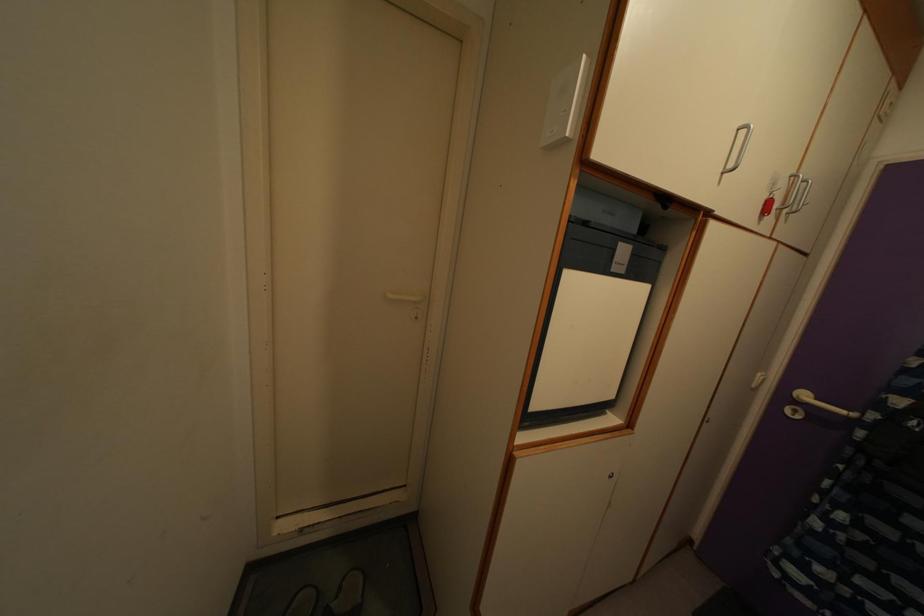
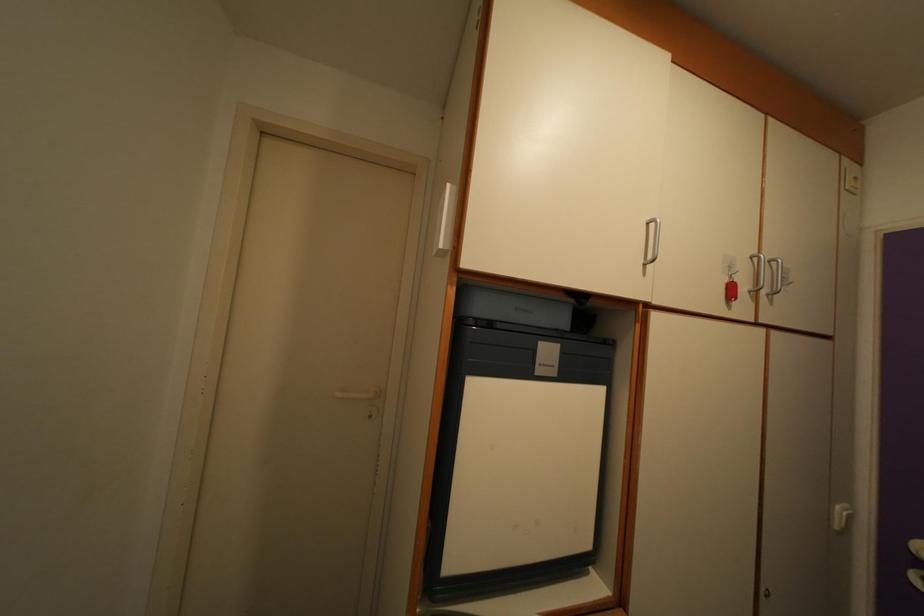
Locate, in the second image, the point that corresponds to point (746, 140) in the first image.

(654, 233)